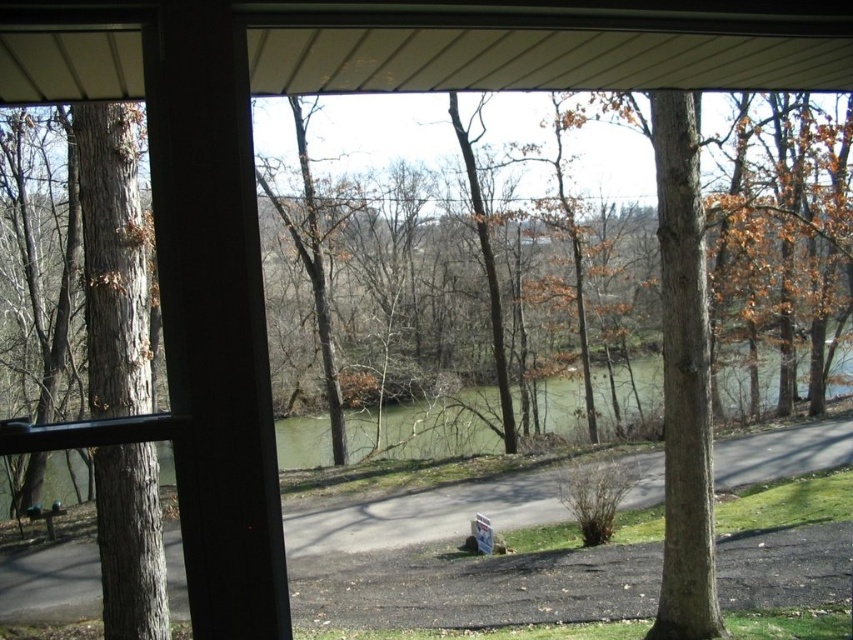
Question: Observing the image, what is the correct spatial positioning of gray bark tree at left in reference to green grassy lake at center?

Choices:
 (A) right
 (B) left

Answer: (B)

Question: Is green grassy lake at center closer to the viewer compared to wooden park bench at lower left?

Choices:
 (A) yes
 (B) no

Answer: (A)

Question: Considering the relative positions of gray bark tree at left and green grassy lake at center in the image provided, where is gray bark tree at left located with respect to green grassy lake at center?

Choices:
 (A) right
 (B) left

Answer: (B)

Question: Which object is positioned farthest from the gray bark tree at left?

Choices:
 (A) wooden park bench at lower left
 (B) green grassy lake at center

Answer: (B)

Question: Which of the following is the closest to the observer?

Choices:
 (A) gray bark tree at left
 (B) green grassy lake at center
 (C) wooden park bench at lower left

Answer: (A)

Question: Considering the real-world distances, which object is farthest from the wooden park bench at lower left?

Choices:
 (A) gray bark tree at left
 (B) green grassy lake at center

Answer: (A)